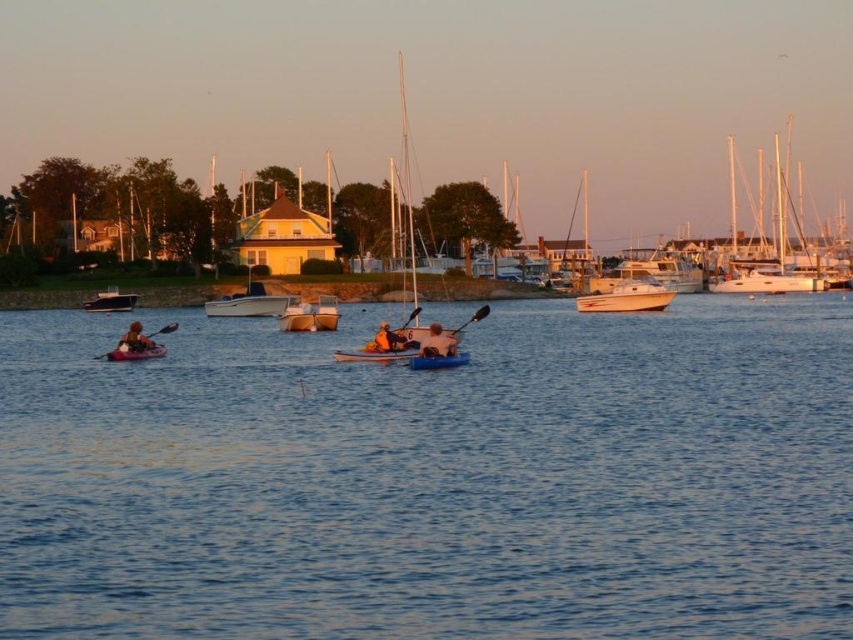
You are standing on the dock and want to choose between the wooden canoe at center and the smooth blue kayak at center for a short trip. Which one is closer to you?

The wooden canoe at center is closer to you because it is positioned further to the viewer than the smooth blue kayak at center.

Consider the image. You are planning to store the wooden canoe at center and the blue plastic canoe at center in a storage shed. The shed has a height limit of 1.5 meters. Which canoe will require a taller storage space?

The wooden canoe at center is taller than the blue plastic canoe at center, so it will require a taller storage space.

You are planning to rent a vessel for a short trip on the water. The rental company has both the white glossy boat at center and the smooth blue kayak at center available. If you want something wider to accommodate your gear, which one should you choose?

The white glossy boat at center is wider than the smooth blue kayak at center, so you should choose the white glossy boat at center for better gear accommodation.